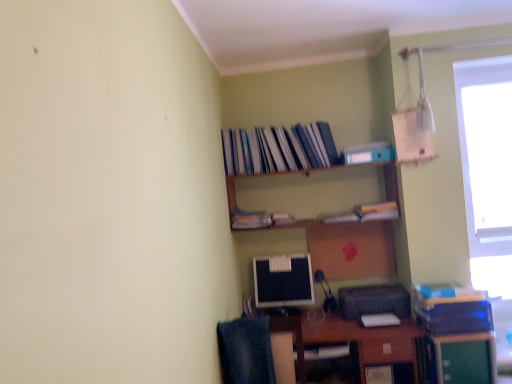
Question: Can you confirm if black plastic printer at lower right is taller than denim at lower left?

Choices:
 (A) no
 (B) yes

Answer: (A)

Question: Considering the relative sizes of black plastic printer at lower right and denim at lower left in the image provided, is black plastic printer at lower right bigger than denim at lower left?

Choices:
 (A) no
 (B) yes

Answer: (A)

Question: Does black plastic printer at lower right contain denim at lower left?

Choices:
 (A) yes
 (B) no

Answer: (B)

Question: Does black plastic printer at lower right have a greater width compared to denim at lower left?

Choices:
 (A) no
 (B) yes

Answer: (B)

Question: Does black plastic printer at lower right have a smaller size compared to denim at lower left?

Choices:
 (A) no
 (B) yes

Answer: (B)

Question: Is black plastic printer at lower right looking in the opposite direction of denim at lower left?

Choices:
 (A) yes
 (B) no

Answer: (B)

Question: Does blue matte paperback book at lower right, positioned as the 2th paperback book in back-to-front order, have a greater height compared to denim at lower left?

Choices:
 (A) yes
 (B) no

Answer: (B)

Question: Would you say blue matte paperback book at lower right, acting as the second paperback book starting from the left, is outside denim at lower left?

Choices:
 (A) yes
 (B) no

Answer: (A)

Question: Does blue matte paperback book at lower right, which is counted as the 1th paperback book, starting from the right, have a smaller size compared to denim at lower left?

Choices:
 (A) no
 (B) yes

Answer: (B)

Question: Does blue matte paperback book at lower right, the first paperback book in the bottom-to-top sequence, appear on the left side of denim at lower left?

Choices:
 (A) no
 (B) yes

Answer: (A)

Question: Does blue matte paperback book at lower right, the first paperback book in the bottom-to-top sequence, have a lesser height compared to denim at lower left?

Choices:
 (A) yes
 (B) no

Answer: (A)

Question: Considering the relative positions of blue matte paperback book at lower right, which is counted as the 1th paperback book, starting from the right, and denim at lower left in the image provided, is blue matte paperback book at lower right, which is counted as the 1th paperback book, starting from the right, to the right of denim at lower left from the viewer's perspective?

Choices:
 (A) no
 (B) yes

Answer: (B)

Question: Can you confirm if hardcover books at upper center, the 1th book viewed from the top, is wider than blue matte paperback book at lower right, which is counted as the 1th paperback book, starting from the right?

Choices:
 (A) yes
 (B) no

Answer: (B)